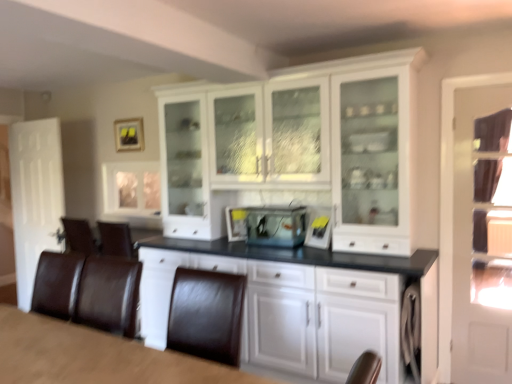
Question: From the image's perspective, is brown leather table at lower left positioned above or below clear glass fish tank at center?

Choices:
 (A) above
 (B) below

Answer: (B)

Question: In terms of width, does brown leather table at lower left look wider or thinner when compared to clear glass fish tank at center?

Choices:
 (A) thin
 (B) wide

Answer: (B)

Question: Which object is the farthest from the clear glass cabinet at upper left?

Choices:
 (A) gray fabric at lower right
 (B) brown leather table at lower left
 (C) clear glass door at right
 (D) white matte door at left
 (E) white glossy cabinet at center

Answer: (C)

Question: Estimate the real-world distances between objects in this image. Which object is closer to the clear glass fish tank at center?

Choices:
 (A) white glossy cabinet at center
 (B) clear glass door at right
 (C) matte black picture frame at upper center
 (D) brown leather table at lower left
 (E) white matte door at left

Answer: (A)